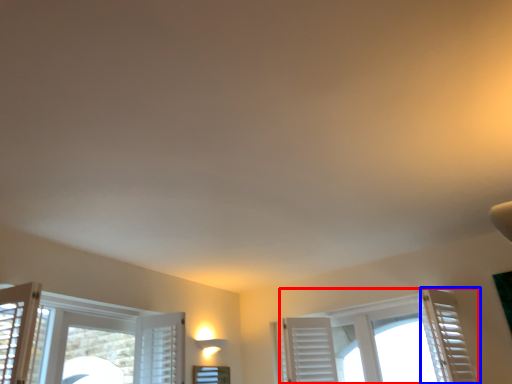
Question: Which of the following is the closest to the observer, window (highlighted by a red box) or curtain (highlighted by a blue box)?

Choices:
 (A) window
 (B) curtain

Answer: (B)